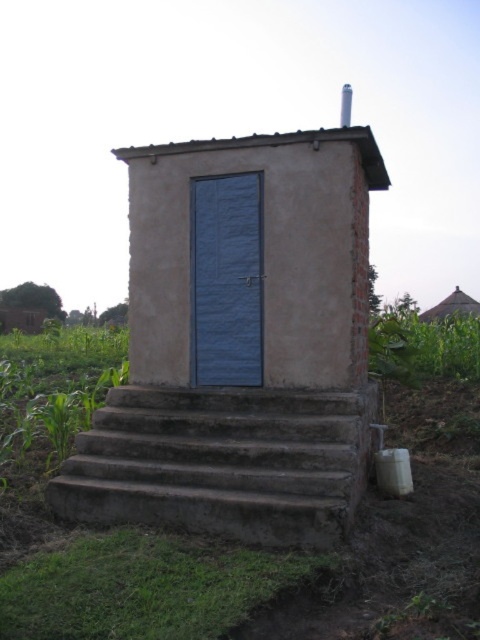
Is point (248, 477) farther from viewer compared to point (238, 218)?

No, (248, 477) is in front of (238, 218).

Locate an element on the screen. concrete stairs at lower center is located at coordinates pyautogui.click(x=222, y=461).

Find the location of a particular element. concrete stairs at lower center is located at coordinates (222, 461).

This screenshot has height=640, width=480. I want to click on concrete stairs at lower center, so click(222, 461).

The image size is (480, 640). Identify the location of concrete stairs at lower center. (222, 461).

Is blue fabric door at center below brown thatched roof at upper right?

Indeed, blue fabric door at center is positioned under brown thatched roof at upper right.

Which is above, blue fabric door at center or brown thatched roof at upper right?

brown thatched roof at upper right is higher up.

Describe the element at coordinates (227, 280) in the screenshot. I see `blue fabric door at center` at that location.

You are a GUI agent. You are given a task and a screenshot of the screen. Output one action in this format:
    pyautogui.click(x=<x>, y=<y>)
    Task: Click on the blue fabric door at center
    This screenshot has width=480, height=640.
    Given the screenshot: What is the action you would take?
    point(227,280)